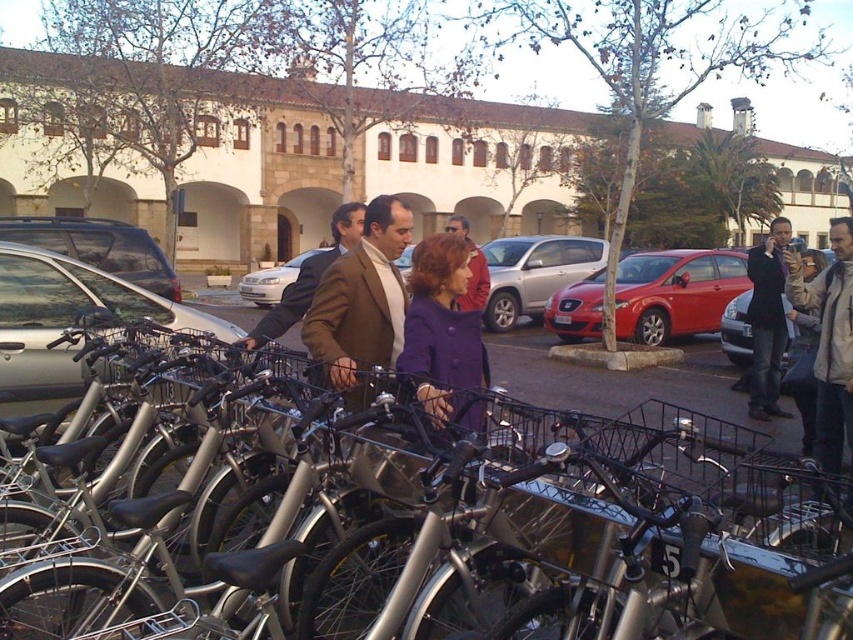
Which is above, purple wool coat at center or dark brown leather jacket at right?

dark brown leather jacket at right

Who is more forward, (415, 291) or (770, 332)?

Point (415, 291) is more forward.

The width and height of the screenshot is (853, 640). I want to click on purple wool coat at center, so click(x=442, y=326).

Is point (123, 275) positioned in front of point (247, 333)?

Yes, it is in front of point (247, 333).

The height and width of the screenshot is (640, 853). What do you see at coordinates (99, 248) in the screenshot? I see `metallic silver car at center` at bounding box center [99, 248].

The image size is (853, 640). In order to click on metallic silver car at center in this screenshot , I will do `click(99, 248)`.

Does satin silver suv at center have a lesser height compared to matte brown coat at center?

Indeed, satin silver suv at center has a lesser height compared to matte brown coat at center.

Can you confirm if satin silver suv at center is thinner than matte brown coat at center?

In fact, satin silver suv at center might be wider than matte brown coat at center.

Is point (605, 241) positioned before point (471, 292)?

No, (605, 241) is behind (471, 292).

Locate an element on the screen. Image resolution: width=853 pixels, height=640 pixels. satin silver suv at center is located at coordinates (534, 273).